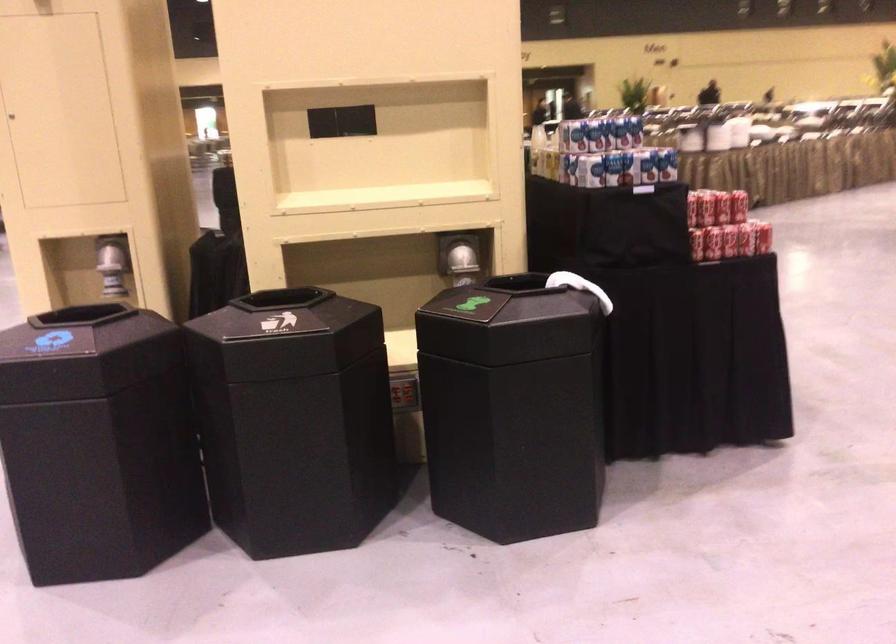
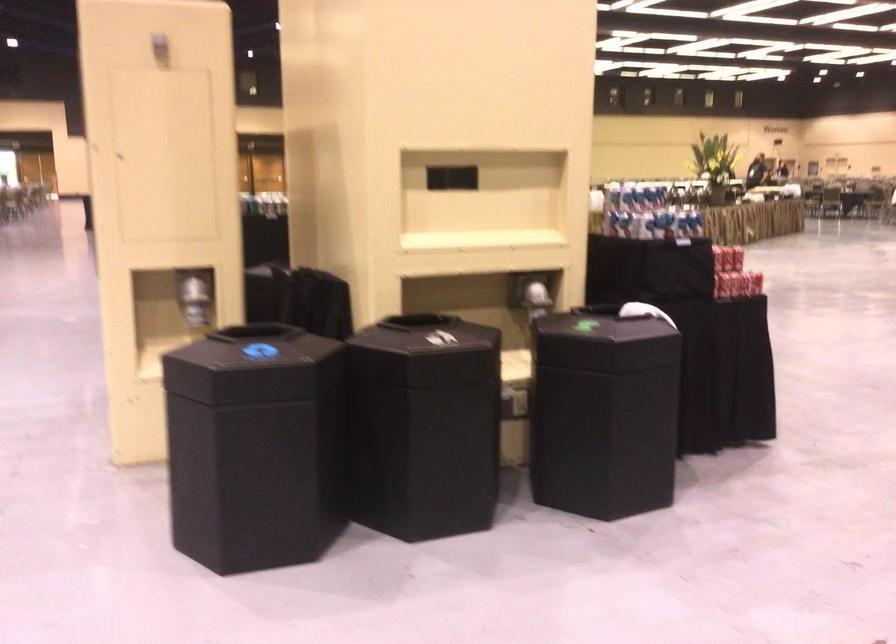
Where in the second image is the point corresponding to [264,339] from the first image?

(425, 351)